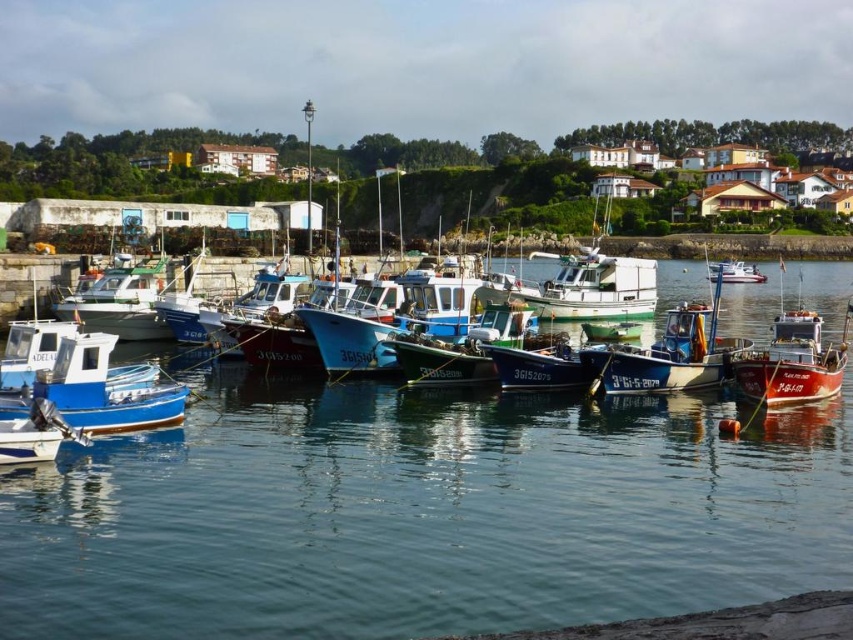
Question: Which object is closer to the camera taking this photo?

Choices:
 (A) white plastic boat at center
 (B) clear water at center

Answer: (B)

Question: Does clear water at center appear under white plastic boat at center?

Choices:
 (A) yes
 (B) no

Answer: (A)

Question: Is clear water at center smaller than white plastic boat at center?

Choices:
 (A) no
 (B) yes

Answer: (A)

Question: Does clear water at center appear on the right side of white plastic boat at center?

Choices:
 (A) yes
 (B) no

Answer: (B)